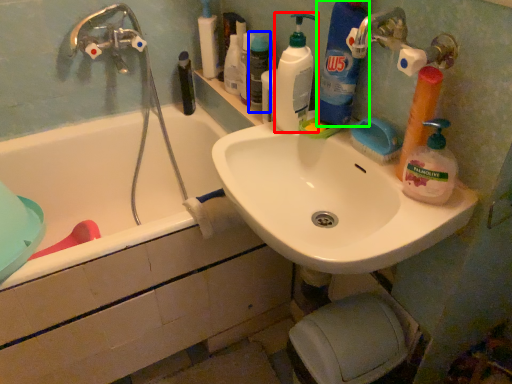
Question: Considering the real-world distances, which object is farthest from cleaning product (highlighted by a red box)? toiletry (highlighted by a blue box) or cleaning product (highlighted by a green box)?

Choices:
 (A) toiletry
 (B) cleaning product

Answer: (A)